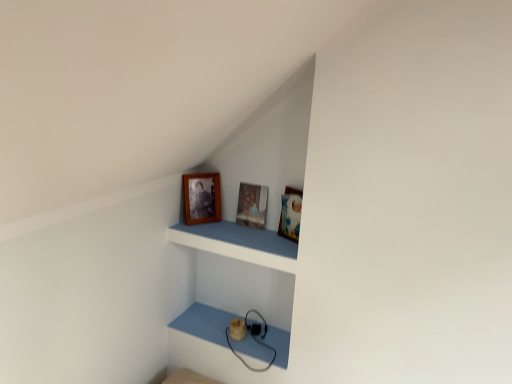
You are a GUI agent. You are given a task and a screenshot of the screen. Output one action in this format:
    pyautogui.click(x=<x>, y=<y>)
    Task: Click on the free area below wooden frame at upper center (from a real-world perspective)
    The height and width of the screenshot is (384, 512).
    Given the screenshot: What is the action you would take?
    pyautogui.click(x=224, y=325)